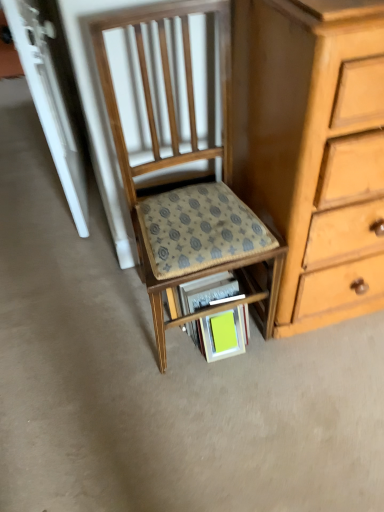
Question: Can you confirm if bright yellow paper at lower center is positioned to the left of patterned fabric step stool at center?

Choices:
 (A) no
 (B) yes

Answer: (A)

Question: Can you confirm if bright yellow paper at lower center is smaller than patterned fabric step stool at center?

Choices:
 (A) yes
 (B) no

Answer: (A)

Question: From a real-world perspective, is bright yellow paper at lower center physically below patterned fabric step stool at center?

Choices:
 (A) yes
 (B) no

Answer: (A)

Question: Is bright yellow paper at lower center thinner than patterned fabric step stool at center?

Choices:
 (A) yes
 (B) no

Answer: (A)

Question: From the image's perspective, is bright yellow paper at lower center located beneath patterned fabric step stool at center?

Choices:
 (A) yes
 (B) no

Answer: (A)

Question: From the image's perspective, does bright yellow paper at lower center appear higher than patterned fabric step stool at center?

Choices:
 (A) no
 (B) yes

Answer: (A)

Question: Is patterned fabric step stool at center positioned before bright yellow paper at lower center?

Choices:
 (A) yes
 (B) no

Answer: (A)

Question: Would you say bright yellow paper at lower center is part of patterned fabric step stool at center's contents?

Choices:
 (A) no
 (B) yes

Answer: (B)

Question: Is the position of patterned fabric step stool at center more distant than that of bright yellow paper at lower center?

Choices:
 (A) no
 (B) yes

Answer: (A)

Question: From a real-world perspective, is patterned fabric step stool at center over bright yellow paper at lower center?

Choices:
 (A) no
 (B) yes

Answer: (B)

Question: Does patterned fabric step stool at center have a smaller size compared to bright yellow paper at lower center?

Choices:
 (A) no
 (B) yes

Answer: (A)

Question: Is patterned fabric step stool at center positioned with its back to bright yellow paper at lower center?

Choices:
 (A) yes
 (B) no

Answer: (B)

Question: Can you see wooden chair at center touching bright yellow paper at lower center?

Choices:
 (A) no
 (B) yes

Answer: (A)